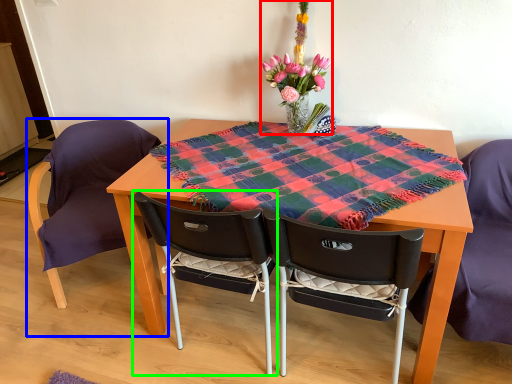
Question: Considering the real-world distances, which object is farthest from floral arrangement (highlighted by a red box)? chair (highlighted by a blue box) or chair (highlighted by a green box)?

Choices:
 (A) chair
 (B) chair

Answer: (A)